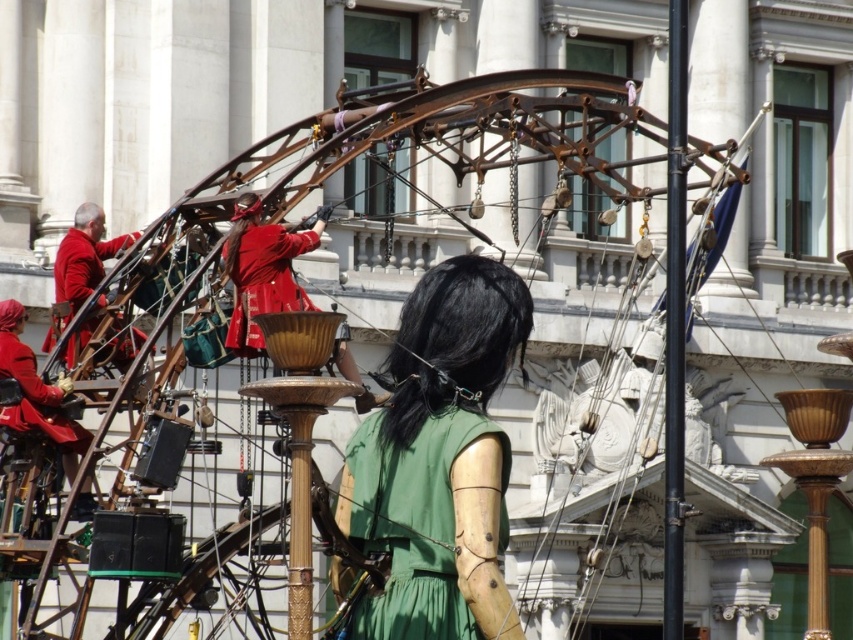
Is green matte dress at center positioned at the back of matte red coat at left?

That is False.

Can you confirm if green matte dress at center is taller than matte red coat at left?

Indeed, green matte dress at center has a greater height compared to matte red coat at left.

The image size is (853, 640). What do you see at coordinates (439, 456) in the screenshot? I see `green matte dress at center` at bounding box center [439, 456].

Locate an element on the screen. This screenshot has height=640, width=853. green matte dress at center is located at coordinates (439, 456).

Between point (341, 589) and point (675, 378), which one is positioned behind?

Point (675, 378)

Between green matte dress at center and black metal pole at upper right, which one is positioned lower?

green matte dress at center is below.

Looking at this image, who is more forward, [490,316] or [668,412]?

Point [490,316]

Find the location of `green matte dress at center`. green matte dress at center is located at coordinates (439, 456).

Does black metal pole at upper right appear under matte red coat at left?

Correct, black metal pole at upper right is located below matte red coat at left.

Between black metal pole at upper right and matte red coat at left, which one is positioned higher?

Positioned higher is matte red coat at left.

Does point (666, 205) lie in front of point (82, 328)?

Yes.

The width and height of the screenshot is (853, 640). What are the coordinates of `black metal pole at upper right` in the screenshot? It's located at (674, 321).